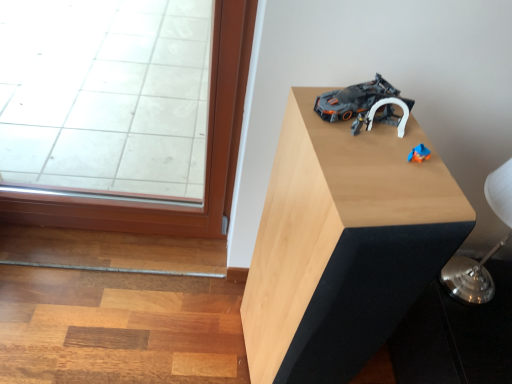
Question: Is dark gray plastic toy car at upper right outside light wood table at upper right?

Choices:
 (A) yes
 (B) no

Answer: (B)

Question: Considering the relative sizes of dark gray plastic toy car at upper right and light wood table at upper right in the image provided, is dark gray plastic toy car at upper right thinner than light wood table at upper right?

Choices:
 (A) no
 (B) yes

Answer: (B)

Question: Considering the relative sizes of dark gray plastic toy car at upper right and light wood table at upper right in the image provided, is dark gray plastic toy car at upper right wider than light wood table at upper right?

Choices:
 (A) yes
 (B) no

Answer: (B)

Question: Considering the relative sizes of dark gray plastic toy car at upper right and light wood table at upper right in the image provided, is dark gray plastic toy car at upper right smaller than light wood table at upper right?

Choices:
 (A) no
 (B) yes

Answer: (B)

Question: From a real-world perspective, is dark gray plastic toy car at upper right positioned under light wood table at upper right based on gravity?

Choices:
 (A) no
 (B) yes

Answer: (A)

Question: From the image's perspective, relative to silver metallic table lamp at upper right, is dark gray plastic toy car at upper right above or below?

Choices:
 (A) below
 (B) above

Answer: (B)

Question: Visually, is dark gray plastic toy car at upper right positioned to the left or to the right of silver metallic table lamp at upper right?

Choices:
 (A) right
 (B) left

Answer: (B)

Question: Would you say dark gray plastic toy car at upper right is inside or outside silver metallic table lamp at upper right?

Choices:
 (A) inside
 (B) outside

Answer: (B)

Question: Is dark gray plastic toy car at upper right wider or thinner than silver metallic table lamp at upper right?

Choices:
 (A) wide
 (B) thin

Answer: (B)

Question: Considering their positions, is light wood table at upper right located in front of or behind silver metallic table lamp at upper right?

Choices:
 (A) behind
 (B) front

Answer: (B)

Question: Is point tap(423, 139) closer or farther from the camera than point tap(498, 241)?

Choices:
 (A) closer
 (B) farther

Answer: (A)

Question: Do you think light wood table at upper right is within silver metallic table lamp at upper right, or outside of it?

Choices:
 (A) outside
 (B) inside

Answer: (A)

Question: From the image's perspective, is light wood table at upper right located above or below silver metallic table lamp at upper right?

Choices:
 (A) above
 (B) below

Answer: (B)

Question: In the image, is silver metallic table lamp at upper right positioned in front of or behind light wood table at upper right?

Choices:
 (A) behind
 (B) front

Answer: (A)

Question: Which is correct: silver metallic table lamp at upper right is inside light wood table at upper right, or outside of it?

Choices:
 (A) inside
 (B) outside

Answer: (B)